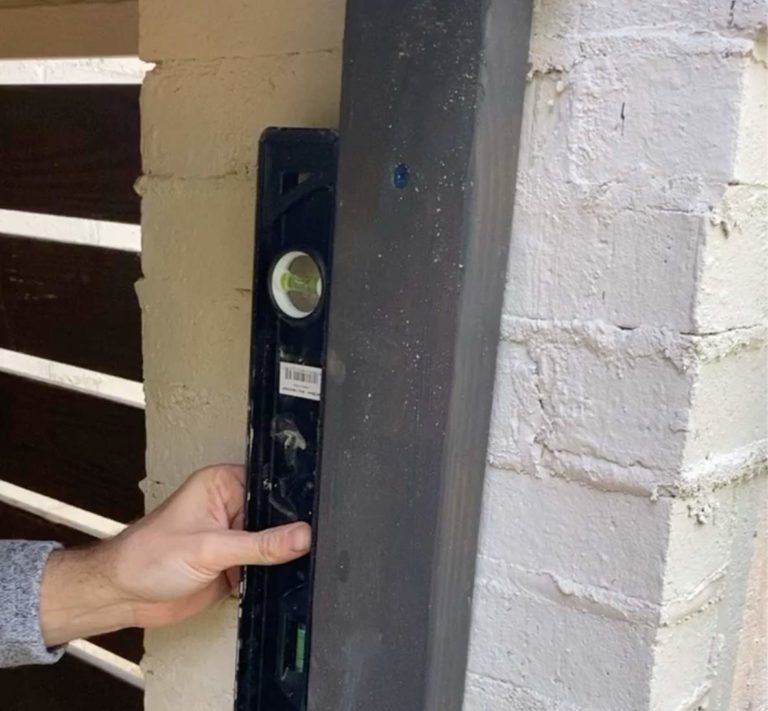
In order to click on wall in this screenshot , I will do `click(634, 195)`.